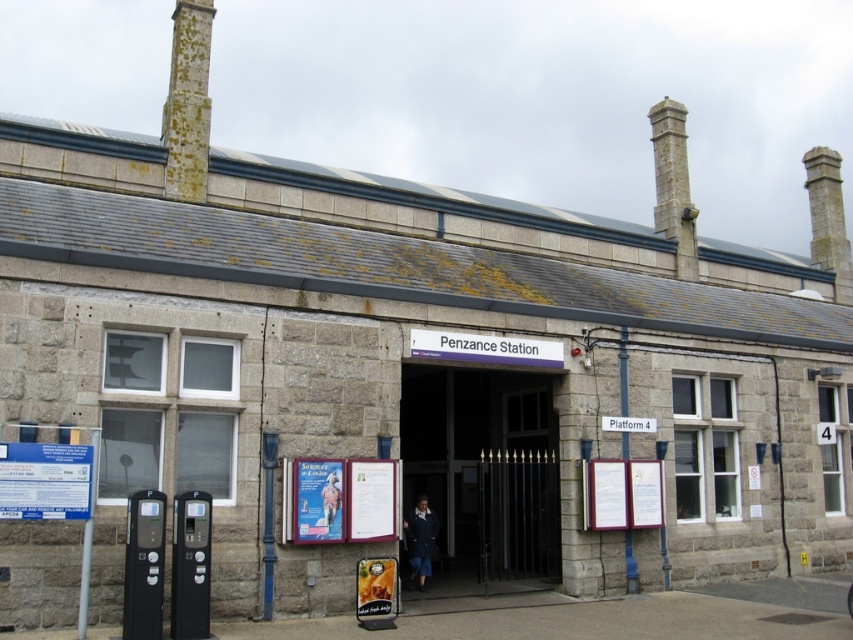
You are a delivery person needing to pass through the smooth stone gate at center to deliver packages to Penzance Station. Considering the gate is narrower than the green mossy stone chimney at upper left, can you safely pass through it with your delivery cart?

The smooth stone gate at center is narrower than the green mossy stone chimney at upper left. Since the gate is narrower, you should check the width of your delivery cart to ensure it can fit through the gate. If the cart is wider than the gate, you may need to find an alternative route or disassemble the cart.

You are a delivery person with a cart that is 2 meters wide. You want to move your cart through the space between the smooth stone gate at center and the green mossy stone chimney at upper left. Is there enough space for your cart to pass through?

The distance between the smooth stone gate at center and the green mossy stone chimney at upper left is 9.32 meters, so yes, the cart can pass through since it is wider than the cart.

You are a visitor approaching Penzance Station and notice the smooth stone gate at center and the green mossy stone chimney at upper left. Which of these two objects is taller?

The green mossy stone chimney at upper left is taller than the smooth stone gate at center.